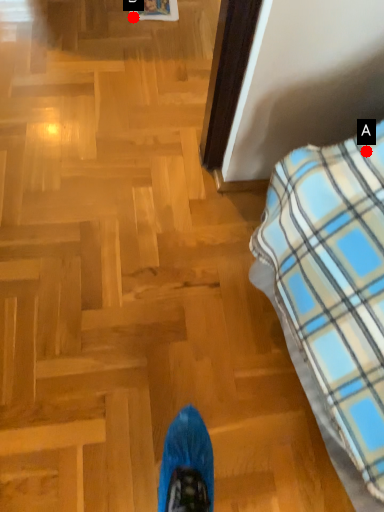
Question: Two points are circled on the image, labeled by A and B beside each circle. Which point is closer to the camera?

Choices:
 (A) A is closer
 (B) B is closer

Answer: (A)